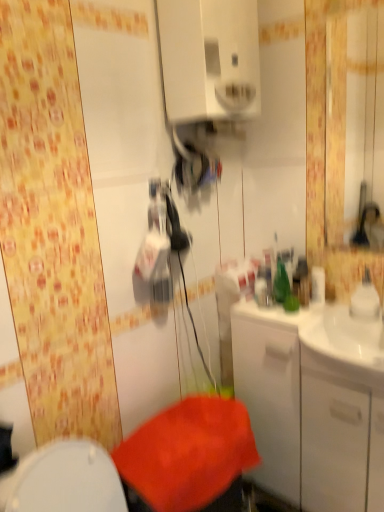
Locate an element on the screen. Image resolution: width=384 pixels, height=512 pixels. empty space that is ontop of white glossy cabinet at right (from a real-world perspective) is located at coordinates (307, 309).